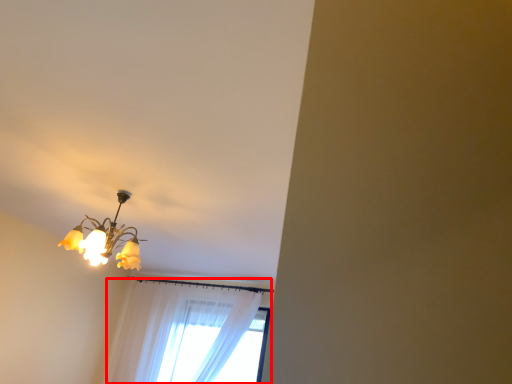
Question: From the image's perspective, what is the correct spatial relationship of curtain (annotated by the red box) in relation to lamp?

Choices:
 (A) below
 (B) above

Answer: (A)